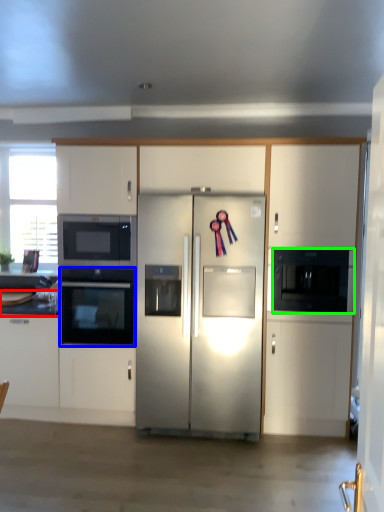
Question: Which object is the closest to the countertop (highlighted by a red box)? Choose among these: oven (highlighted by a blue box) or microwave oven (highlighted by a green box).

Choices:
 (A) oven
 (B) microwave oven

Answer: (A)